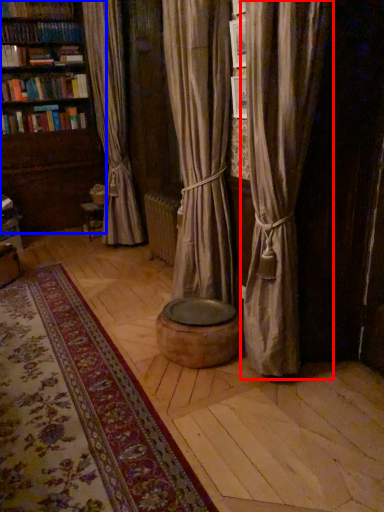
Question: Which object appears closest to the camera in this image, curtain (highlighted by a red box) or bookcase (highlighted by a blue box)?

Choices:
 (A) curtain
 (B) bookcase

Answer: (A)